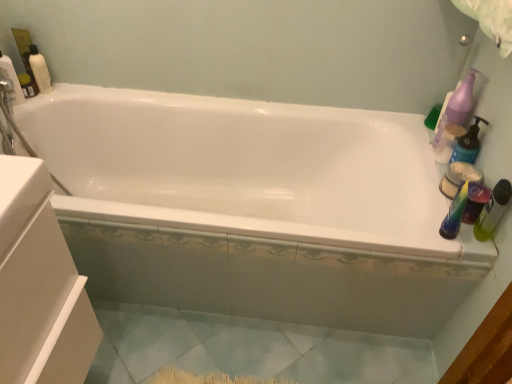
Question: Is purple plastic pump bottle at upper right, the 1th cleaning product viewed from the right, at the left side of matte white bottle at upper left, arranged as the 3th cleaning product when viewed from the right?

Choices:
 (A) yes
 (B) no

Answer: (B)

Question: Considering the relative positions of purple plastic pump bottle at upper right, the 1th cleaning product viewed from the right, and matte white bottle at upper left, arranged as the 3th cleaning product when viewed from the right, in the image provided, is purple plastic pump bottle at upper right, the 1th cleaning product viewed from the right, in front of matte white bottle at upper left, arranged as the 3th cleaning product when viewed from the right,?

Choices:
 (A) yes
 (B) no

Answer: (A)

Question: Considering the relative sizes of purple plastic pump bottle at upper right, placed as the 2th cleaning product when sorted from bottom to top, and matte white bottle at upper left, arranged as the 3th cleaning product when viewed from the right, in the image provided, is purple plastic pump bottle at upper right, placed as the 2th cleaning product when sorted from bottom to top, wider than matte white bottle at upper left, arranged as the 3th cleaning product when viewed from the right,?

Choices:
 (A) yes
 (B) no

Answer: (A)

Question: Could you tell me if purple plastic pump bottle at upper right, placed as the 2th cleaning product when sorted from bottom to top, is facing matte white bottle at upper left, the third cleaning product in the bottom-to-top sequence?

Choices:
 (A) yes
 (B) no

Answer: (A)

Question: Can you confirm if purple plastic pump bottle at upper right, the 1th cleaning product viewed from the right, is smaller than matte white bottle at upper left, arranged as the 3th cleaning product when viewed from the right?

Choices:
 (A) no
 (B) yes

Answer: (A)

Question: From the image's perspective, would you say purple plastic pump bottle at upper right, the 1th cleaning product viewed from the right, is shown under matte white bottle at upper left, arranged as the 3th cleaning product when viewed from the right?

Choices:
 (A) yes
 (B) no

Answer: (A)

Question: Is translucent green bottle at right, which is the 1th toiletry in front-to-back order, completely or partially outside of matte white bottle at upper left, the third cleaning product in the bottom-to-top sequence?

Choices:
 (A) yes
 (B) no

Answer: (A)

Question: Considering the relative sizes of translucent green bottle at right, which is the 1th toiletry in front-to-back order, and matte white bottle at upper left, the third cleaning product in the bottom-to-top sequence, in the image provided, is translucent green bottle at right, which is the 1th toiletry in front-to-back order, shorter than matte white bottle at upper left, the third cleaning product in the bottom-to-top sequence,?

Choices:
 (A) yes
 (B) no

Answer: (A)

Question: Is translucent green bottle at right, acting as the second toiletry starting from the back, facing towards matte white bottle at upper left, the third cleaning product in the bottom-to-top sequence?

Choices:
 (A) no
 (B) yes

Answer: (A)

Question: Does translucent green bottle at right, acting as the second toiletry starting from the back, have a greater height compared to matte white bottle at upper left, which is the first cleaning product in left-to-right order?

Choices:
 (A) yes
 (B) no

Answer: (B)

Question: Considering the relative sizes of translucent green bottle at right, which is the 1th toiletry in front-to-back order, and matte white bottle at upper left, which is the first cleaning product in left-to-right order, in the image provided, is translucent green bottle at right, which is the 1th toiletry in front-to-back order, wider than matte white bottle at upper left, which is the first cleaning product in left-to-right order,?

Choices:
 (A) yes
 (B) no

Answer: (B)

Question: Is translucent green bottle at right, which is the 1th toiletry in front-to-back order, not close to matte white bottle at upper left, the 1th cleaning product viewed from the top?

Choices:
 (A) yes
 (B) no

Answer: (A)

Question: Is matte white bottle at upper left, which is the first cleaning product in left-to-right order, at the right side of purple plastic pump bottle at upper right, placed as the 2th cleaning product when sorted from bottom to top?

Choices:
 (A) yes
 (B) no

Answer: (B)